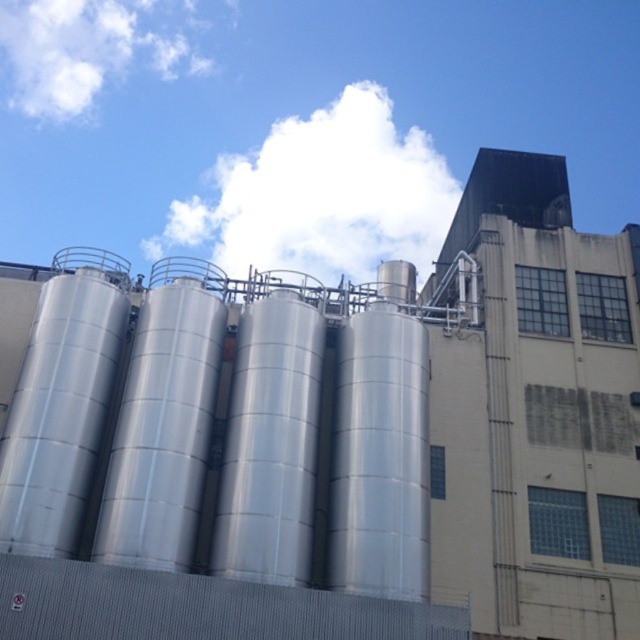
Question: Among these objects, which one is farthest from the camera?

Choices:
 (A) white fluffy cloud at upper left
 (B) white fluffy cloud at upper center

Answer: (A)

Question: Which of the following is the closest to the observer?

Choices:
 (A) white fluffy cloud at upper center
 (B) white fluffy cloud at upper left

Answer: (A)

Question: Does white fluffy cloud at upper center come behind white fluffy cloud at upper left?

Choices:
 (A) no
 (B) yes

Answer: (A)

Question: Does white fluffy cloud at upper center appear on the left side of white fluffy cloud at upper left?

Choices:
 (A) yes
 (B) no

Answer: (B)

Question: Can you confirm if white fluffy cloud at upper center is positioned below white fluffy cloud at upper left?

Choices:
 (A) no
 (B) yes

Answer: (B)